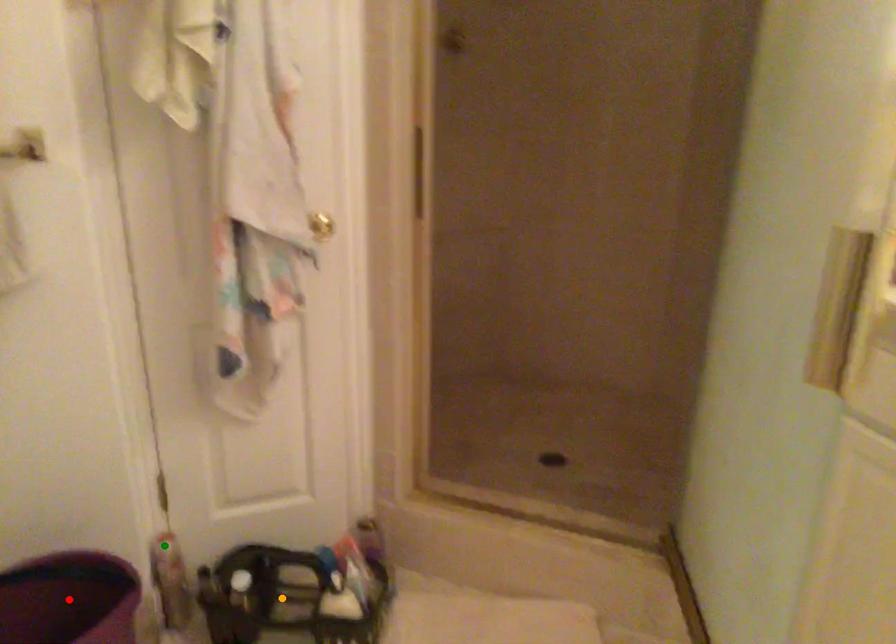
Order these from nearest to farthest:
- orange point
- green point
- red point

orange point, green point, red point